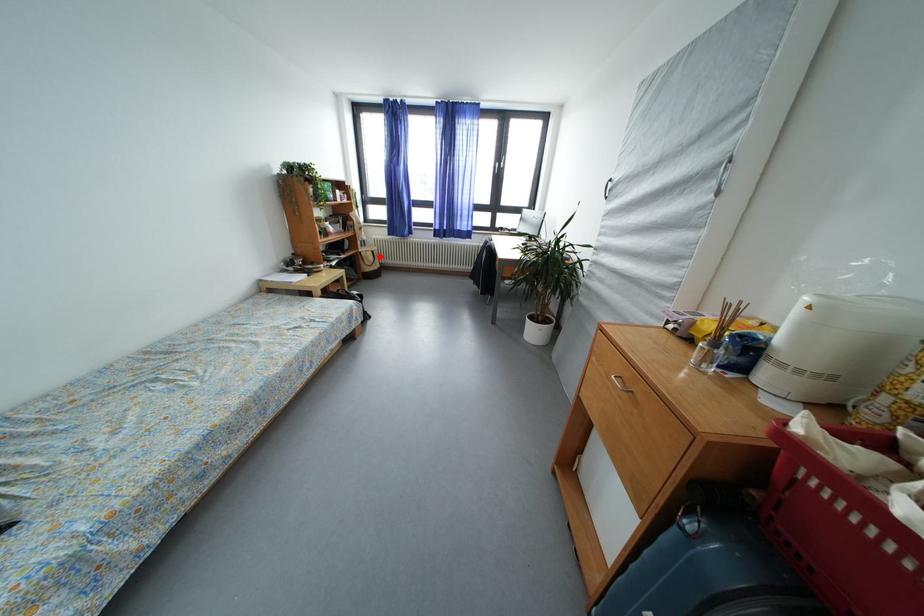
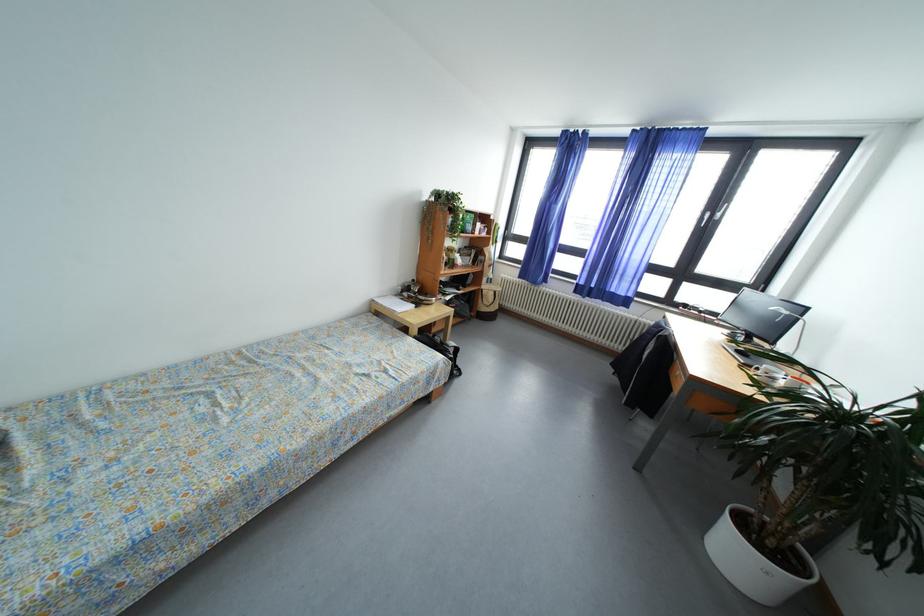
Question: I am providing you with two images of the same scene from different viewpoints. Image1 has a red point marked. In image2, the corresponding 3D location appears at what relative position? Reply with the corresponding letter.

Choices:
 (A) Closer
 (B) Farther

Answer: (B)